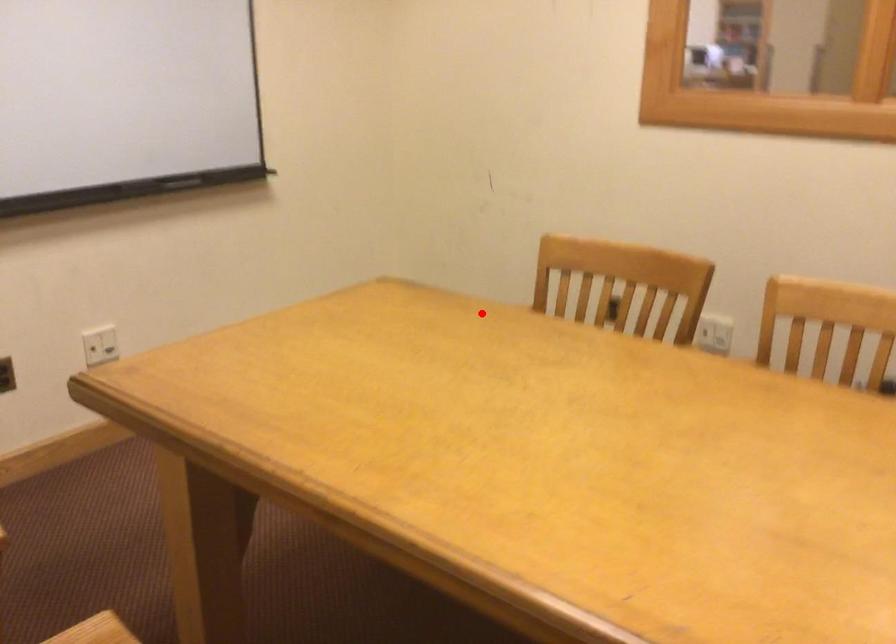
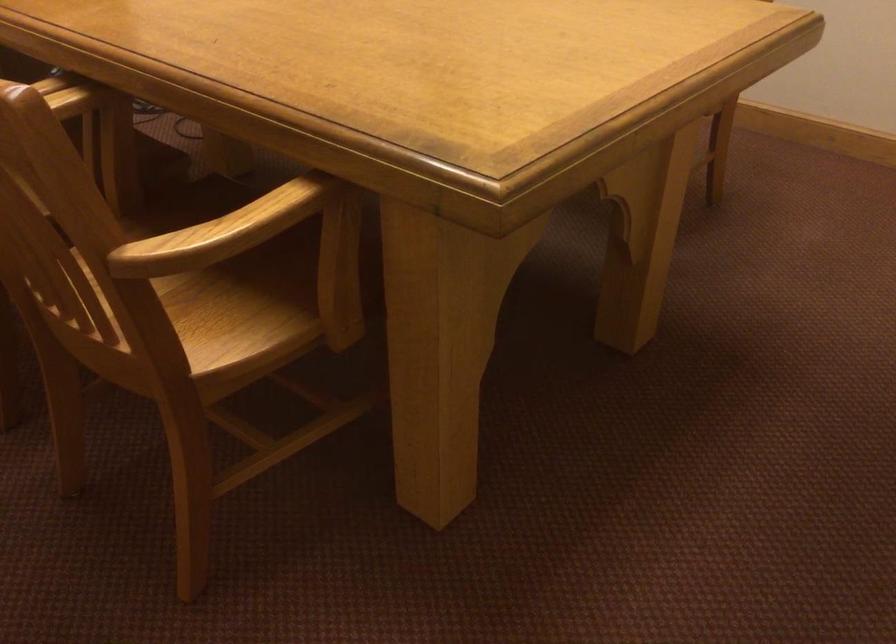
Question: A red point is marked in image1. In image2, is the corresponding 3D point closer to the camera or farther? Reply with the corresponding letter.

Choices:
 (A) The corresponding 3D point is closer.
 (B) The corresponding 3D point is farther.

Answer: (A)